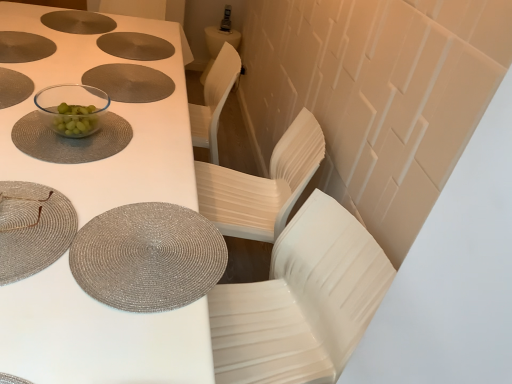
Find the location of `vacant space behind transparent glass bowl at center, which ranks as the 3th tableware in bottom-to-top order`. vacant space behind transparent glass bowl at center, which ranks as the 3th tableware in bottom-to-top order is located at coordinates (87, 91).